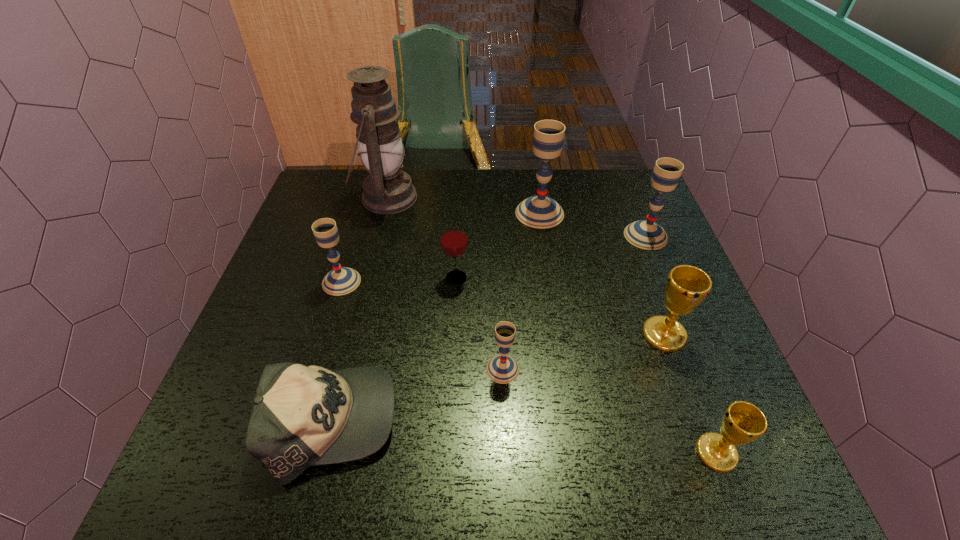
Find the location of a particular element. empty location between the eighth shortest object and the leftmost chalice is located at coordinates click(x=441, y=247).

The width and height of the screenshot is (960, 540). Find the location of `free space between the third farthest chalice and the farther gold chalice`. free space between the third farthest chalice and the farther gold chalice is located at coordinates 503,308.

I want to click on free space that is in between the sixth object from right to left and the nearest chalice, so click(587, 366).

Find the location of a particular element. The image size is (960, 540). object that stands as the seventh closest to the green baseball cap is located at coordinates (742, 422).

Locate an element on the screen. object that ranks as the closest to the farther gold chalice is located at coordinates (742, 422).

What are the coordinates of `the fourth closest chalice to the green baseball cap` in the screenshot? It's located at (539, 211).

Identify which chalice is located as the sixth nearest to the red glass. Please provide its 2D coordinates. Your answer should be formatted as a tuple, i.e. [(x, y)], where the tuple contains the x and y coordinates of a point satisfying the conditions above.

[(742, 422)]

Point out which gray chalice is positioned as the third nearest to the farther gold chalice. Please provide its 2D coordinates. Your answer should be formatted as a tuple, i.e. [(x, y)], where the tuple contains the x and y coordinates of a point satisfying the conditions above.

[(539, 211)]

This screenshot has width=960, height=540. What are the coordinates of `gray chalice that is the third closest to the nearer gold chalice` in the screenshot? It's located at (539, 211).

In order to click on vacant region that satisfies the following two spatial constraints: 1. on the back side of the second gray chalice from left to right; 2. on the left side of the second tallest object in this screenshot , I will do `click(496, 213)`.